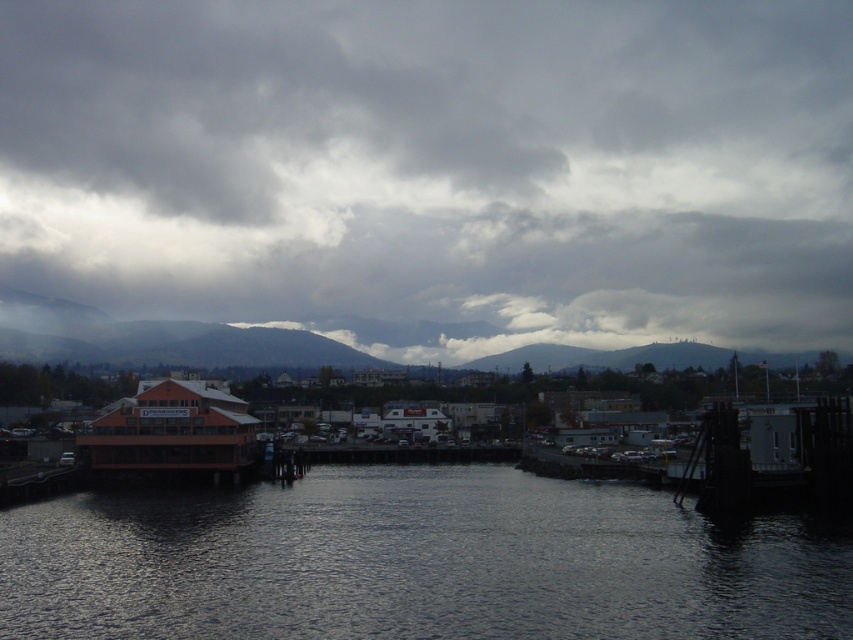
Question: Which object appears farthest from the camera in this image?

Choices:
 (A) dark reflective water at center
 (B) cloudy gray sky at upper center

Answer: (B)

Question: Is cloudy gray sky at upper center wider than dark reflective water at center?

Choices:
 (A) yes
 (B) no

Answer: (A)

Question: Which of the following is the farthest from the observer?

Choices:
 (A) dark reflective water at center
 (B) cloudy gray sky at upper center

Answer: (B)

Question: Observing the image, what is the correct spatial positioning of cloudy gray sky at upper center in reference to dark reflective water at center?

Choices:
 (A) above
 (B) below

Answer: (A)

Question: Which object is farther from the camera taking this photo?

Choices:
 (A) dark reflective water at center
 (B) cloudy gray sky at upper center

Answer: (B)

Question: Is cloudy gray sky at upper center to the left of dark reflective water at center from the viewer's perspective?

Choices:
 (A) yes
 (B) no

Answer: (B)